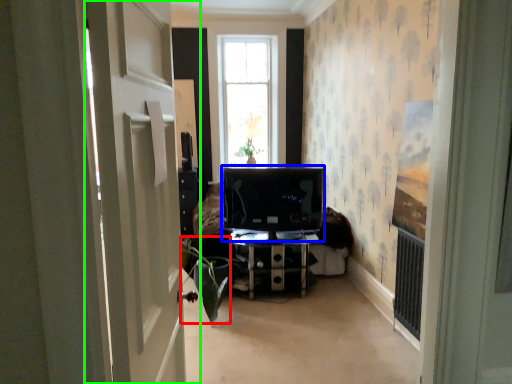
Question: Which object is the closest to the plant (highlighted by a red box)? Choose among these: computer monitor (highlighted by a blue box) or door (highlighted by a green box).

Choices:
 (A) computer monitor
 (B) door

Answer: (A)